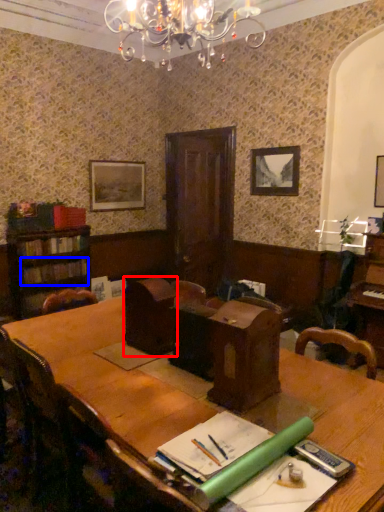
Question: Which object appears farthest to the camera in this image, armchair (highlighted by a red box) or book (highlighted by a blue box)?

Choices:
 (A) armchair
 (B) book

Answer: (B)